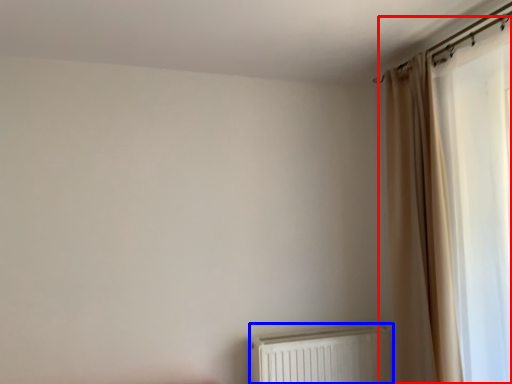
Question: Which of the following is the closest to the observer, curtain (highlighted by a red box) or radiator (highlighted by a blue box)?

Choices:
 (A) curtain
 (B) radiator

Answer: (A)